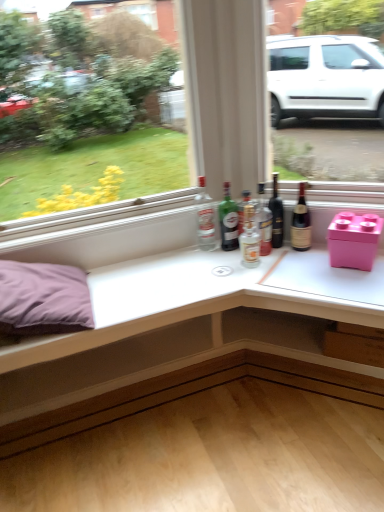
Question: From a real-world perspective, is white glossy table at upper center located higher than dark glass bottle at center?

Choices:
 (A) no
 (B) yes

Answer: (A)

Question: Is white glossy table at upper center shorter than dark glass bottle at center?

Choices:
 (A) no
 (B) yes

Answer: (A)

Question: From a real-world perspective, is white glossy table at upper center positioned under dark glass bottle at center based on gravity?

Choices:
 (A) no
 (B) yes

Answer: (B)

Question: Considering the relative positions of white glossy table at upper center and dark glass bottle at center in the image provided, is white glossy table at upper center to the left of dark glass bottle at center from the viewer's perspective?

Choices:
 (A) yes
 (B) no

Answer: (A)

Question: From the image's perspective, does white glossy table at upper center appear higher than dark glass bottle at center?

Choices:
 (A) no
 (B) yes

Answer: (A)

Question: Does point (246, 197) appear closer or farther from the camera than point (28, 372)?

Choices:
 (A) closer
 (B) farther

Answer: (B)

Question: From the image's perspective, is translucent glass bottle at center, the third bottle viewed from the left, above or below white glossy table at upper center?

Choices:
 (A) above
 (B) below

Answer: (A)

Question: Is translucent glass bottle at center, placed as the third bottle when sorted from right to left, taller or shorter than white glossy table at upper center?

Choices:
 (A) tall
 (B) short

Answer: (B)

Question: Considering the positions of translucent glass bottle at center, the third bottle viewed from the left, and white glossy table at upper center in the image, is translucent glass bottle at center, the third bottle viewed from the left, wider or thinner than white glossy table at upper center?

Choices:
 (A) thin
 (B) wide

Answer: (A)

Question: Based on their positions, is dark glass bottle at center located to the left or right of clear glass bottle at center, which is the first bottle in left-to-right order?

Choices:
 (A) left
 (B) right

Answer: (B)

Question: Considering the positions of dark glass bottle at center and clear glass bottle at center, which ranks as the 5th bottle in right-to-left order, in the image, is dark glass bottle at center bigger or smaller than clear glass bottle at center, which ranks as the 5th bottle in right-to-left order,?

Choices:
 (A) small
 (B) big

Answer: (A)

Question: In the image, is dark glass bottle at center positioned in front of or behind clear glass bottle at center, which is the first bottle in left-to-right order?

Choices:
 (A) front
 (B) behind

Answer: (A)

Question: From the image's perspective, relative to clear glass bottle at center, which is the first bottle in left-to-right order, is dark glass bottle at center above or below?

Choices:
 (A) above
 (B) below

Answer: (A)

Question: Is point (243, 198) positioned closer to the camera than point (344, 254)?

Choices:
 (A) closer
 (B) farther

Answer: (B)

Question: Do you think translucent glass bottle at center, placed as the third bottle when sorted from right to left, is within pink plastic storage box at right, or outside of it?

Choices:
 (A) inside
 (B) outside

Answer: (B)